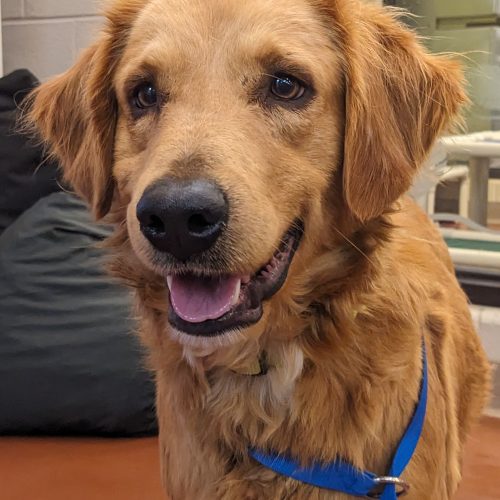
Identify the location of wall. The height and width of the screenshot is (500, 500). (38, 41).